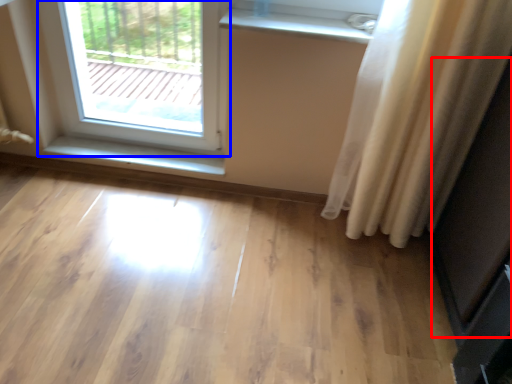
Question: Which of the following is the closest to the observer, screen door (highlighted by a red box) or window (highlighted by a blue box)?

Choices:
 (A) screen door
 (B) window

Answer: (A)